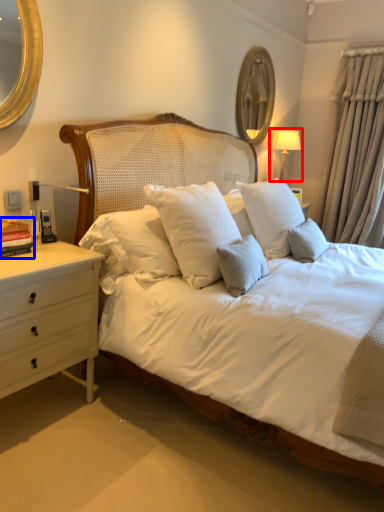
Question: Which object is closer to the camera taking this photo, bedside lamp (highlighted by a red box) or book (highlighted by a blue box)?

Choices:
 (A) bedside lamp
 (B) book

Answer: (B)